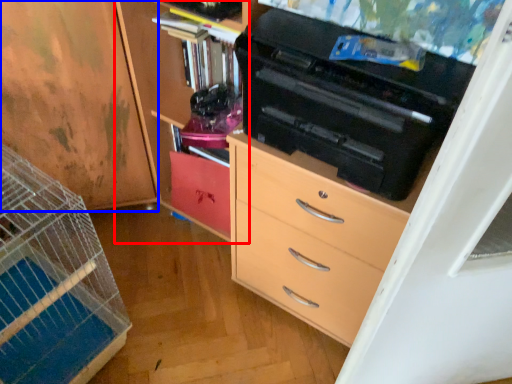
Question: Which point is further to the camera, cabinetry (highlighted by a red box) or cabinetry (highlighted by a blue box)?

Choices:
 (A) cabinetry
 (B) cabinetry

Answer: (B)